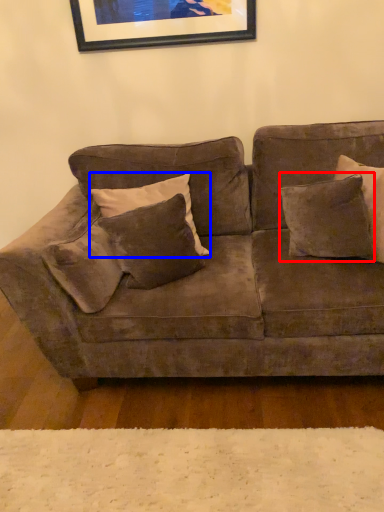
Question: Which point is further to the camera, pillow (highlighted by a red box) or pillow (highlighted by a blue box)?

Choices:
 (A) pillow
 (B) pillow

Answer: (A)